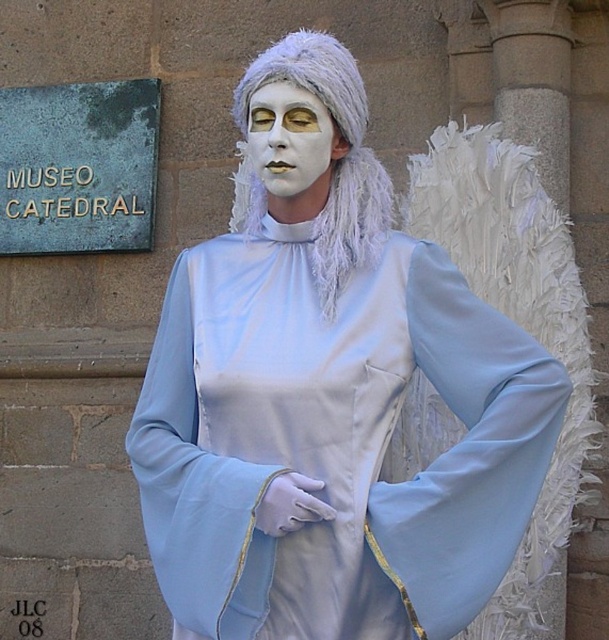
You are a photographer trying to capture the satin blue angel at center and the white fluffy wig at center. Which object should you focus on first to ensure both are in sharp focus?

The satin blue angel at center is closer to the viewer than the white fluffy wig at center, so focusing on the satin blue angel at center will ensure both are in sharp focus.

You are a photographer setting up for a photoshoot with the satin blue angel at center and the white fluffy wig at center. You need to position the two objects so that they are exactly 2 meters apart. Based on the current setup, will you need to move them closer or farther apart to achieve the desired distance?

The satin blue angel at center and the white fluffy wig at center are currently 2.08 meters apart. To reach the desired 2 meters, you need to move them closer by 0.08 meters.